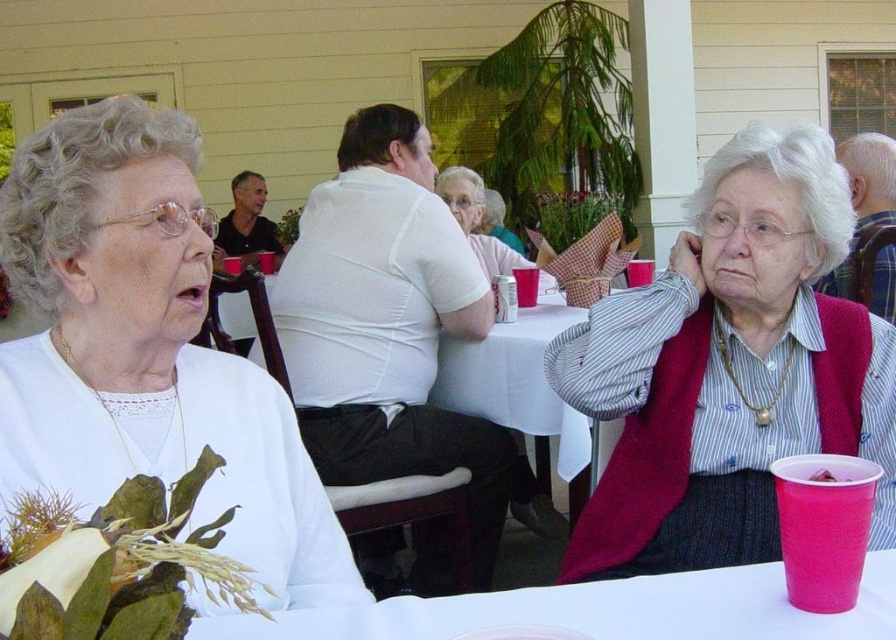
You are a photographer standing at the edge of the scene wanting to capture both the striped fabric shirt at center and the white plastic table at lower center in a single frame. Given their distance apart, can you fit both into your camera view without moving your position?

The striped fabric shirt at center and the white plastic table at lower center are 65.70 centimeters apart. Since the distance between them is fixed, you can adjust your camera angle or zoom to include both objects in the frame without needing to move your position.

In the scene described, there is a point located at coordinates (145, 349). Which object from the list of objects does this point lie on?

The point at (145, 349) lies on the white matte shirt at upper left.

You are a photographer at the event and want to capture both the white matte shirt at upper left and the striped fabric shirt at center in a single photo. Which shirt should you focus on first to ensure both are in frame?

The white matte shirt at upper left is positioned over the striped fabric shirt at center, so focusing on the white matte shirt at upper left first will ensure both are visible in the photo.